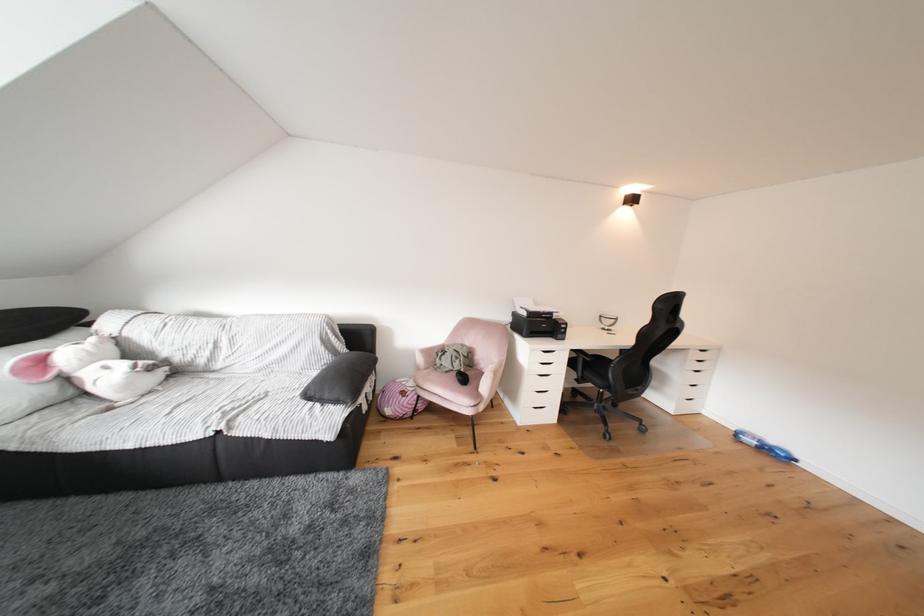
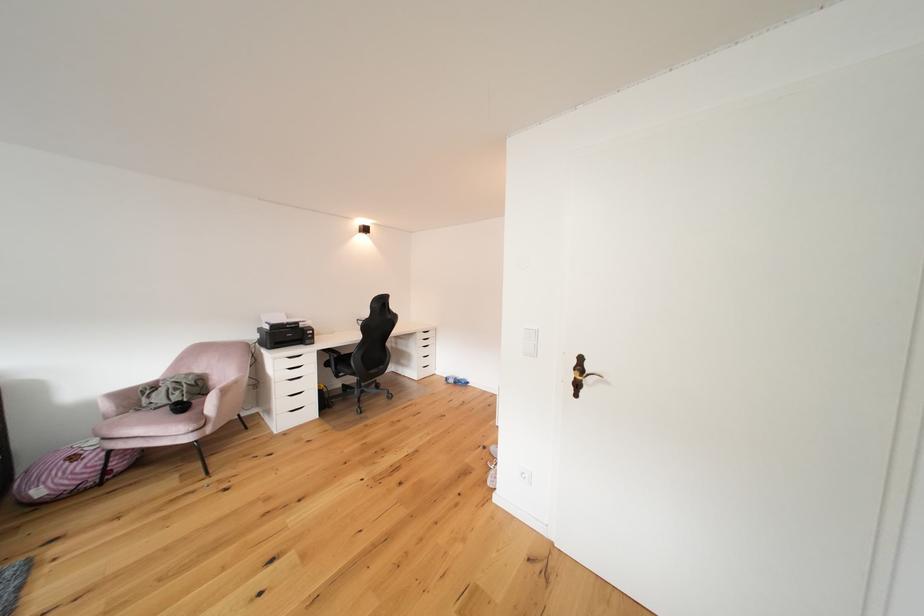
Find the pixel in the second image that matches the point at 472,383 in the first image.

(190, 411)